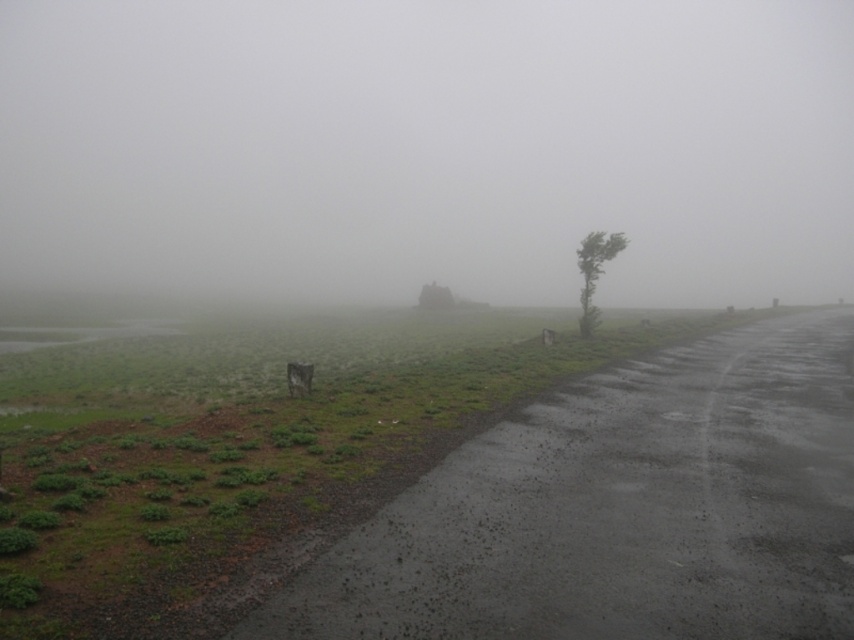
Is foggy atmosphere at center closer to camera compared to green leafy tree at right?

No, foggy atmosphere at center is behind green leafy tree at right.

Is foggy atmosphere at center wider than green leafy tree at right?

Correct, the width of foggy atmosphere at center exceeds that of green leafy tree at right.

In the scene shown: Measure the distance between point (571, 109) and camera.

396.30 meters

Locate an element on the screen. foggy atmosphere at center is located at coordinates (427, 147).